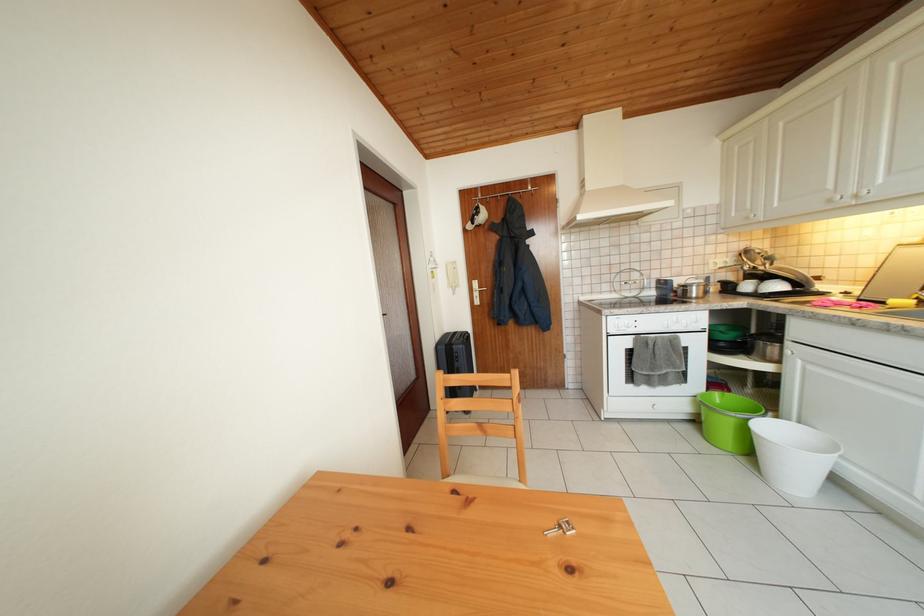
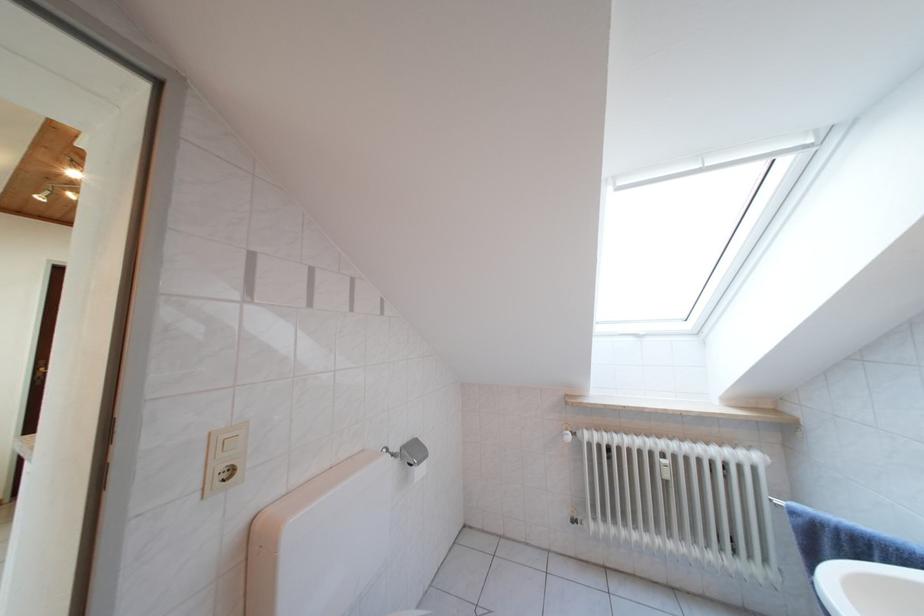
Question: What movement of the cameraman would produce the second image?

Choices:
 (A) Left
 (B) Right
 (C) Forward
 (D) Backward

Answer: (B)